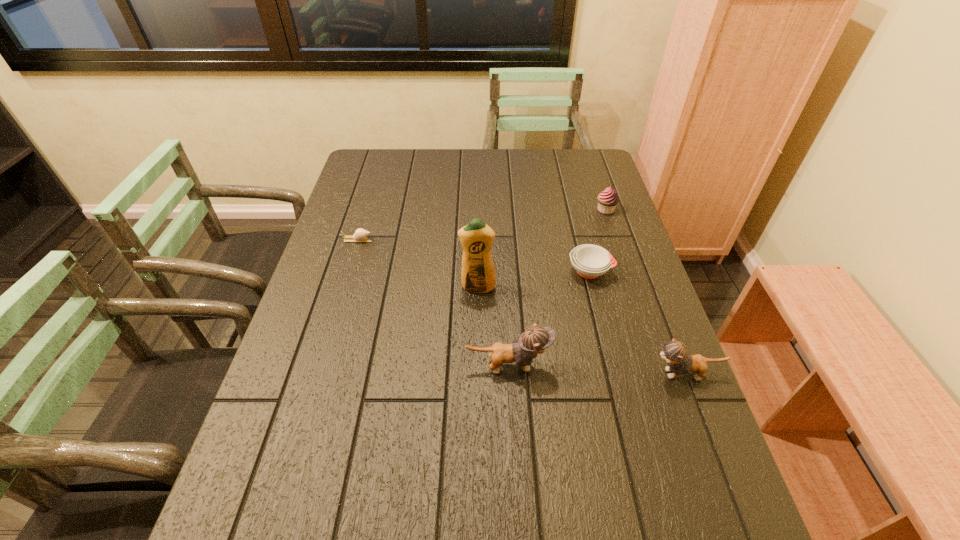
I want to click on vacant place for an extra kitten on the left, so click(337, 358).